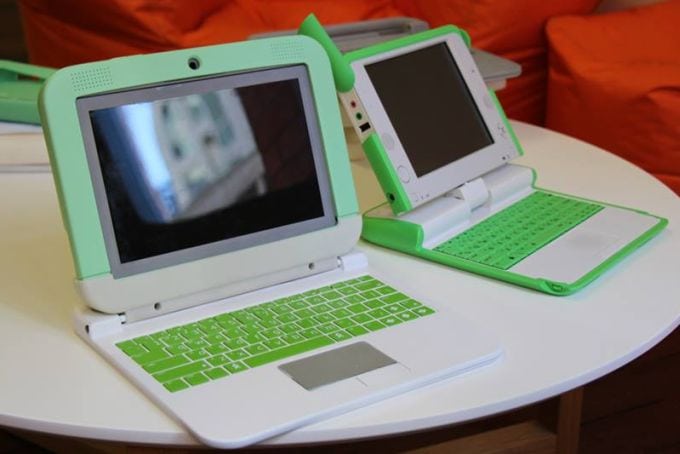
Where is `red couch`? red couch is located at coordinates click(x=498, y=24).